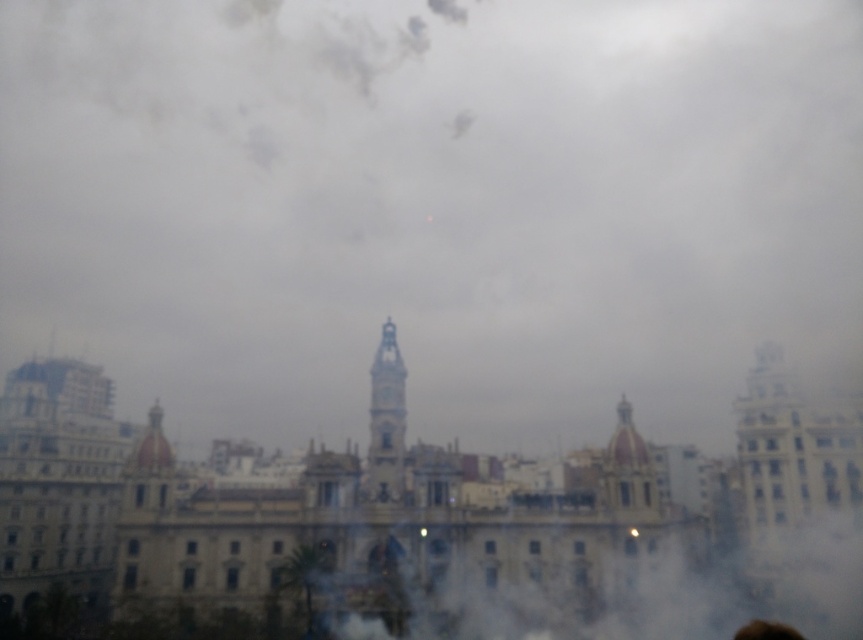
Question: In this image, where is white cotton cloud at upper center located relative to brown hair at upper center?

Choices:
 (A) right
 (B) left

Answer: (B)

Question: Can you confirm if white cotton cloud at upper center is wider than brown hair at upper center?

Choices:
 (A) yes
 (B) no

Answer: (A)

Question: Can you confirm if white cotton cloud at upper center is positioned to the right of brown hair at upper center?

Choices:
 (A) no
 (B) yes

Answer: (A)